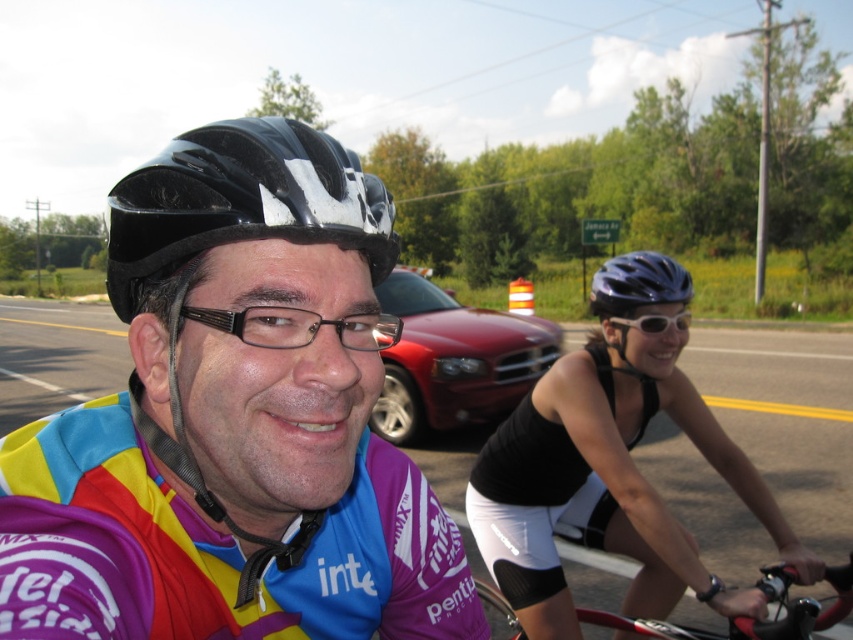
Question: Is matte cycling jersey at center to the right of black matte bicycle helmet at center from the viewer's perspective?

Choices:
 (A) yes
 (B) no

Answer: (A)

Question: Which point is closer to the camera?

Choices:
 (A) black matte helmet at center
 (B) matte cycling jersey at center
 (C) black plastic glasses at center

Answer: (B)

Question: Which object is positioned farthest from the shiny red car at center?

Choices:
 (A) black matte bicycle helmet at center
 (B) black matte helmet at center
 (C) white matte sunglasses at center

Answer: (A)

Question: Does shiny red car at center appear on the left side of black plastic glasses at center?

Choices:
 (A) yes
 (B) no

Answer: (B)

Question: Which point is farther from the camera taking this photo?

Choices:
 (A) click(x=793, y=572)
 (B) click(x=660, y=268)

Answer: (B)

Question: Is black matte helmet at center in front of black plastic glasses at center?

Choices:
 (A) yes
 (B) no

Answer: (B)